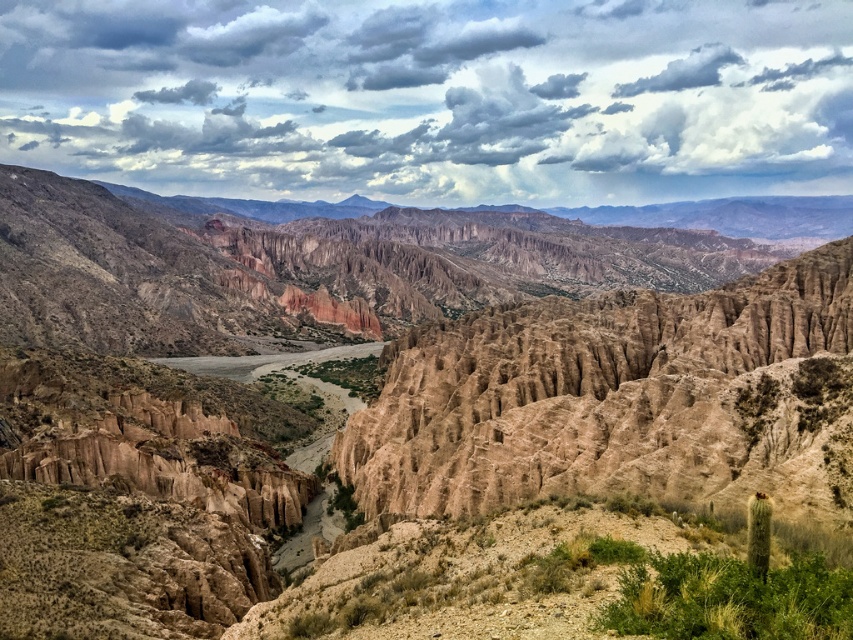
Question: Does cloudy sky at upper center have a greater width compared to brown sandy river at center?

Choices:
 (A) yes
 (B) no

Answer: (A)

Question: Which point appears closest to the camera in this image?

Choices:
 (A) (0, 602)
 (B) (280, 355)

Answer: (A)

Question: Considering the relative positions of brown rocky terrain at center and cloudy sky at upper center in the image provided, where is brown rocky terrain at center located with respect to cloudy sky at upper center?

Choices:
 (A) right
 (B) left

Answer: (B)

Question: Estimate the real-world distances between objects in this image. Which object is closer to the cloudy sky at upper center?

Choices:
 (A) brown rocky terrain at center
 (B) brown sandy river at center

Answer: (A)

Question: Which object is closer to the camera taking this photo?

Choices:
 (A) brown rocky terrain at center
 (B) brown sandy river at center
 (C) cloudy sky at upper center

Answer: (A)

Question: Is cloudy sky at upper center positioned before brown sandy river at center?

Choices:
 (A) yes
 (B) no

Answer: (B)